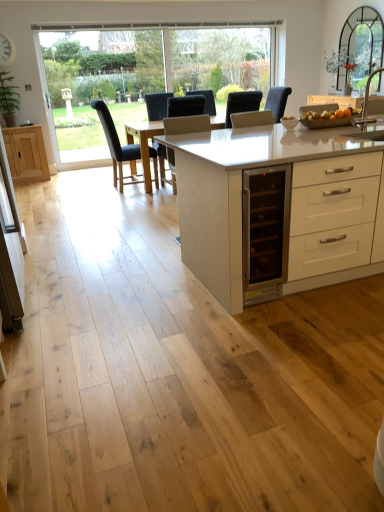
Question: In terms of height, does clear glass window at upper left look taller or shorter compared to white glossy table at center?

Choices:
 (A) tall
 (B) short

Answer: (A)

Question: Considering the relative positions of clear glass window at upper left and white glossy table at center in the image provided, is clear glass window at upper left to the left or to the right of white glossy table at center?

Choices:
 (A) right
 (B) left

Answer: (B)

Question: Based on their relative distances, which object is nearer to the silver metallic sink at right?

Choices:
 (A) clear glass window at upper left
 (B) matte oak cabinet at left
 (C) black leather chair at center, placed as the second chair when sorted from right to left
 (D) dark gray fabric chair at center, which is the first chair in right-to-left order
 (E) white glossy table at center

Answer: (E)

Question: Based on their relative distances, which object is nearer to the matte oak cabinet at left?

Choices:
 (A) black leather chair at center, which is the 1th chair in left-to-right order
 (B) clear glass window at upper left
 (C) white glossy table at center
 (D) dark gray fabric chair at center, which is the 2th chair in left-to-right order
 (E) silver metallic sink at right

Answer: (A)